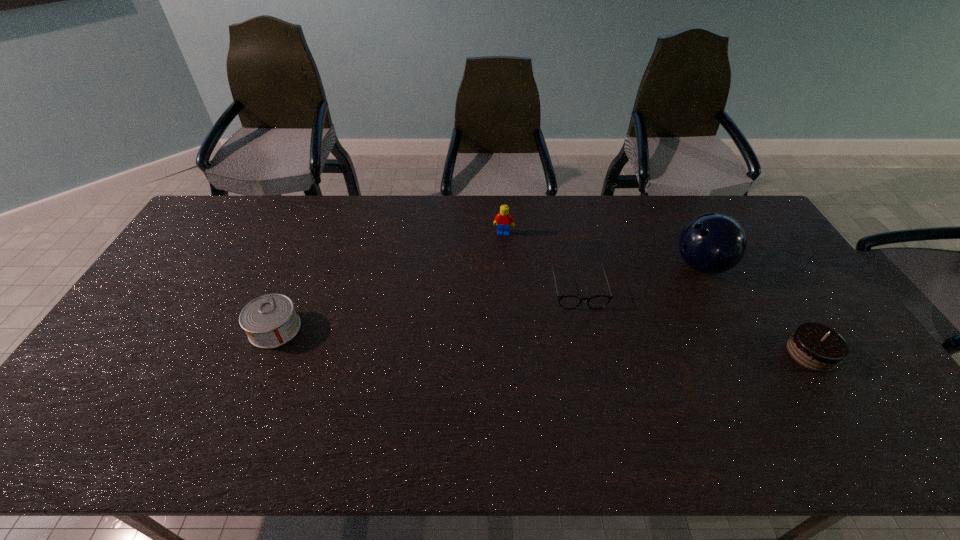
At what (x,y) coordinates should I click in order to perform the action: click on vacant space that satisfies the following two spatial constraints: 1. on the front side of the fourth shortest object; 2. on the right side of the tallest object. Please return your answer as a coordinate pair (x, y). This screenshot has height=540, width=960. Looking at the image, I should click on (505, 266).

Locate an element on the screen. free space in the image that satisfies the following two spatial constraints: 1. on the front side of the chocolate cake; 2. on the right side of the fourth object from left to right is located at coordinates (747, 353).